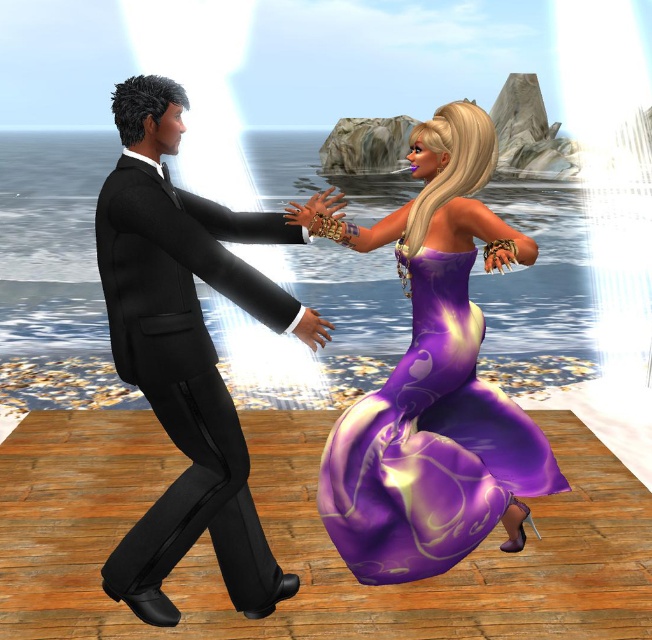
Question: Is matte black suit at left thinner than purple satin dress at center?

Choices:
 (A) no
 (B) yes

Answer: (B)

Question: Is matte black suit at left further to camera compared to purple satin dress at center?

Choices:
 (A) yes
 (B) no

Answer: (B)

Question: Which object is farther from the camera taking this photo?

Choices:
 (A) matte black suit at left
 (B) purple satin dress at center

Answer: (B)

Question: Considering the relative positions of matte black suit at left and purple satin dress at center in the image provided, where is matte black suit at left located with respect to purple satin dress at center?

Choices:
 (A) below
 (B) above

Answer: (B)